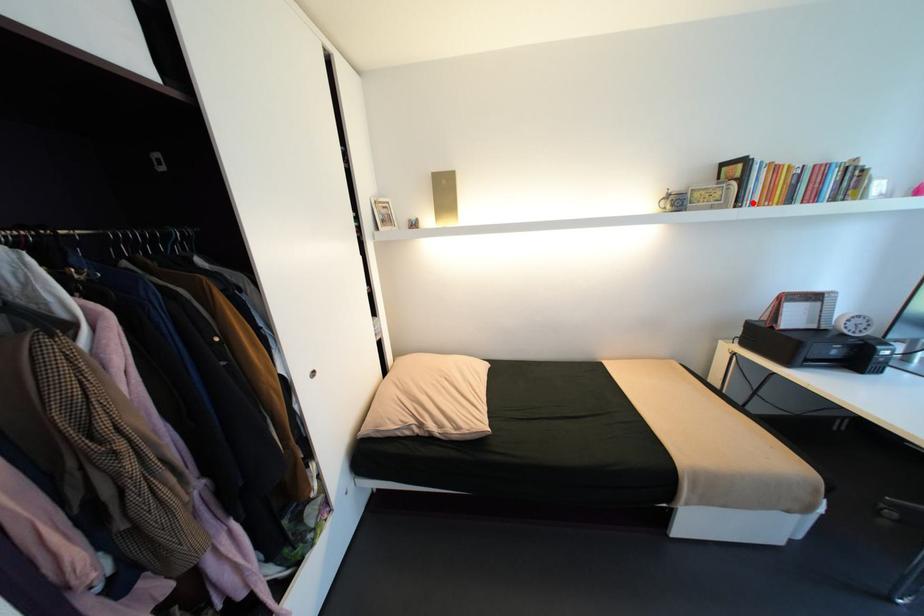
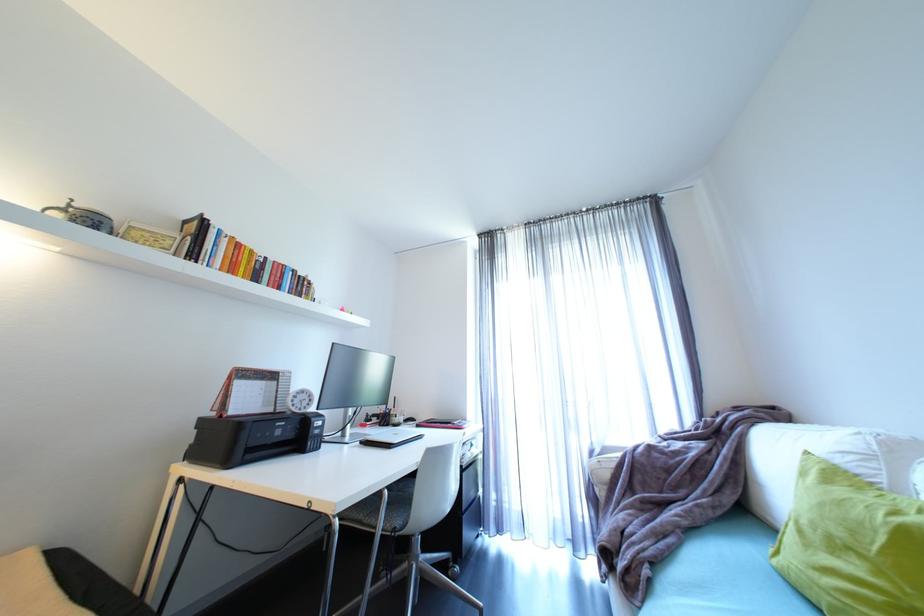
The point at the highlighted location is marked in the first image. Where is the corresponding point in the second image?

(208, 262)